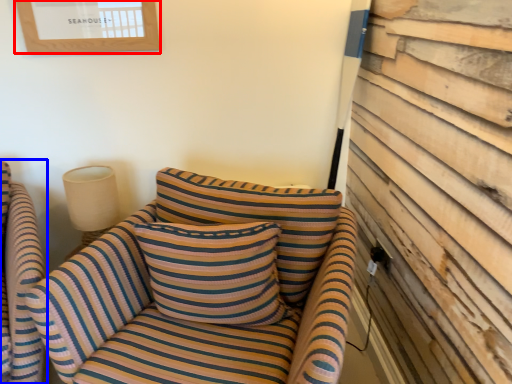
Question: Which object appears closest to the camera in this image, picture frame (highlighted by a red box) or chair (highlighted by a blue box)?

Choices:
 (A) picture frame
 (B) chair

Answer: (B)